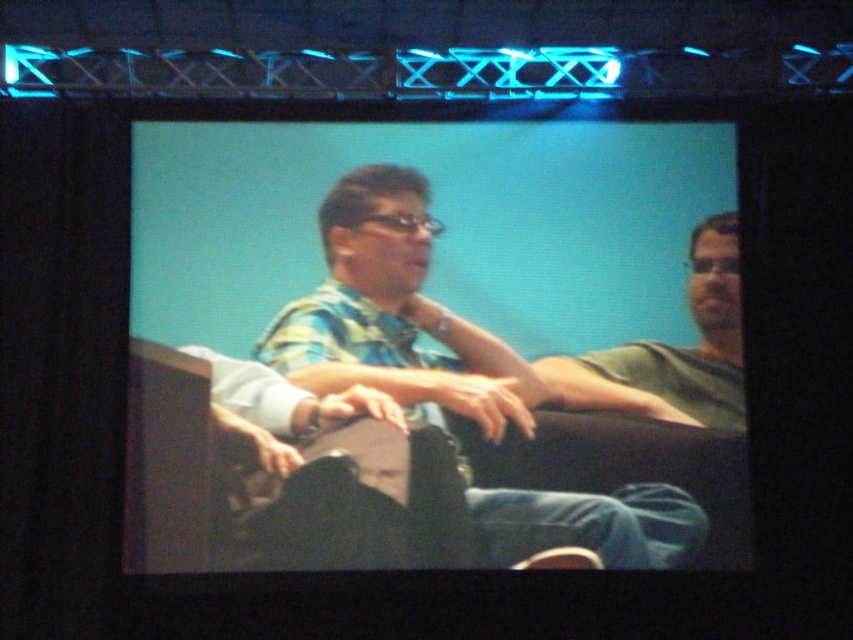
Question: Is multicolored fabric shirt at center to the right of green matte shirt at right from the viewer's perspective?

Choices:
 (A) no
 (B) yes

Answer: (A)

Question: Can you confirm if multicolored fabric shirt at center is positioned to the left of green matte shirt at right?

Choices:
 (A) yes
 (B) no

Answer: (A)

Question: Is multicolored fabric shirt at center wider than green matte shirt at right?

Choices:
 (A) no
 (B) yes

Answer: (B)

Question: Which of the following is the farthest from the observer?

Choices:
 (A) green matte shirt at right
 (B) multicolored fabric shirt at center

Answer: (A)